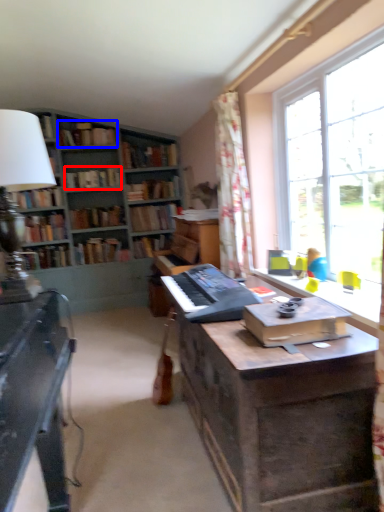
Question: Which object appears farthest to the camera in this image, book (highlighted by a red box) or book (highlighted by a blue box)?

Choices:
 (A) book
 (B) book

Answer: (A)